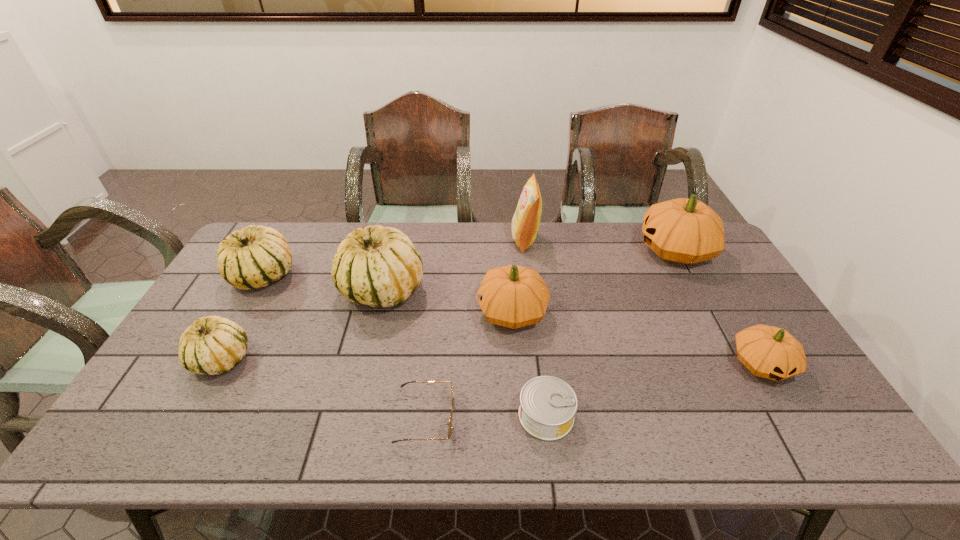
Locate an element on the screen. object that is at the far right corner is located at coordinates (686, 231).

The width and height of the screenshot is (960, 540). I want to click on free region at the far edge of the desktop, so click(511, 252).

You are a GUI agent. You are given a task and a screenshot of the screen. Output one action in this format:
    pyautogui.click(x=<x>, y=<y>)
    Task: Click on the free region at the near edge of the desktop
    
    Given the screenshot: What is the action you would take?
    click(x=749, y=454)

At what (x,y) coordinates should I click in order to perform the action: click on vacant space at the left edge of the desktop. Please return your answer as a coordinate pair (x, y). Looking at the image, I should click on (212, 380).

The image size is (960, 540). I want to click on vacant space at the right edge of the desktop, so click(x=765, y=407).

Locate an element on the screen. free space between the can and the crisp (potato chip) is located at coordinates (536, 327).

What are the coordinates of `free space between the second biggest white gourd and the smallest white gourd` in the screenshot? It's located at (242, 318).

Find the location of a particular element. free space between the fourth gourd from left to right and the biggest orange gourd is located at coordinates (593, 281).

Locate an element on the screen. unoccupied area between the second smallest orange gourd and the rightmost white gourd is located at coordinates (447, 301).

Locate an element on the screen. Image resolution: width=960 pixels, height=540 pixels. vacant point located between the farthest orange gourd and the second smallest white gourd is located at coordinates (469, 263).